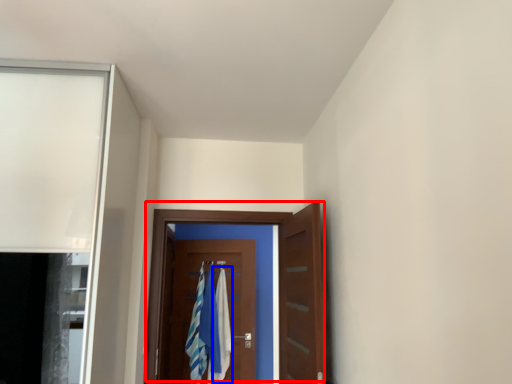
Question: Which of the following is the closest to the observer, door (highlighted by a red box) or bath towel (highlighted by a blue box)?

Choices:
 (A) door
 (B) bath towel

Answer: (A)